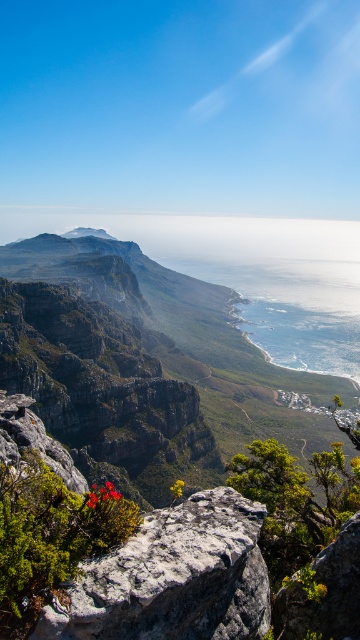
Can you confirm if gray rough rock at center is wider than bright red flower at center?

No.

What do you see at coordinates (173, 579) in the screenshot?
I see `gray rough rock at center` at bounding box center [173, 579].

Find the location of `gray rough rock at center`. gray rough rock at center is located at coordinates (173, 579).

You are a GUI agent. You are given a task and a screenshot of the screen. Output one action in this format:
    pyautogui.click(x=<x>, y=<y>)
    Task: Click on the gray rough rock at center
    The width and height of the screenshot is (360, 640).
    Given the screenshot: What is the action you would take?
    pyautogui.click(x=173, y=579)

Which is above, gray rough rock at center or matte gray rock at center?

matte gray rock at center is higher up.

Does point (200, 515) lie in front of point (65, 236)?

That is True.

Where is `gray rough rock at center`? This screenshot has height=640, width=360. gray rough rock at center is located at coordinates (173, 579).

This screenshot has height=640, width=360. What are the coordinates of `blue liquid water at center` in the screenshot? It's located at (293, 308).

Is blue liquid water at center further to camera compared to matte gray rock at center?

No.

Identify the location of blue liquid water at center. (293, 308).

Identify the location of blue liquid water at center. The height and width of the screenshot is (640, 360). (293, 308).